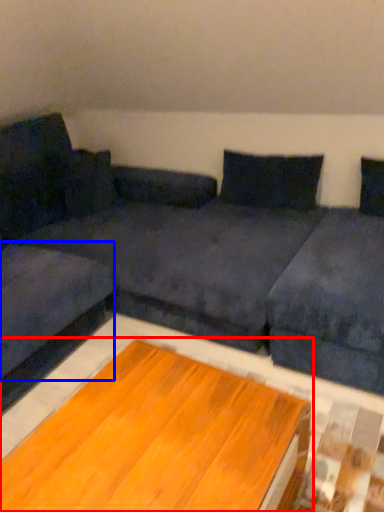
Question: Which object is closer to the camera taking this photo, table (highlighted by a red box) or couch (highlighted by a blue box)?

Choices:
 (A) table
 (B) couch

Answer: (A)